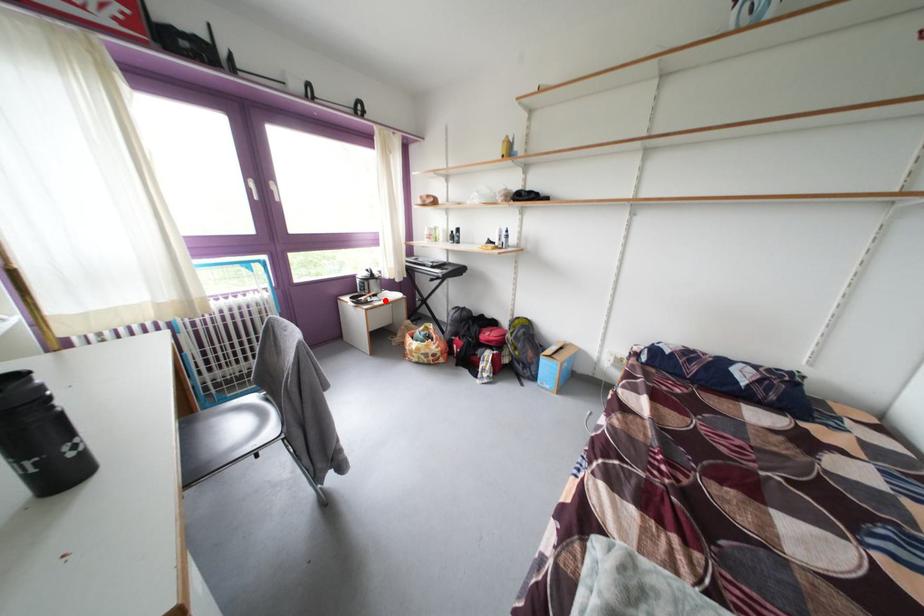
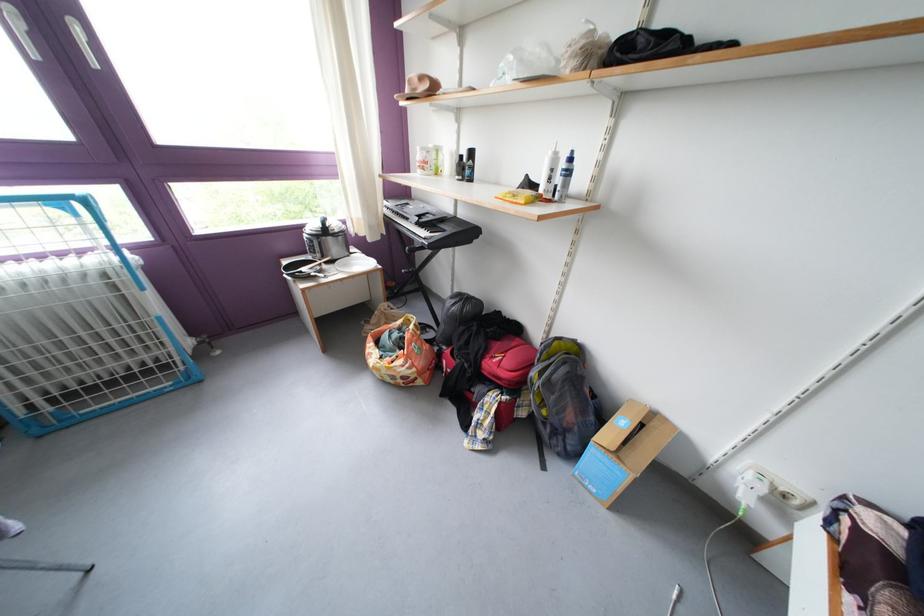
In the second image, find the point that corresponds to the highlighted location in the first image.

(344, 267)